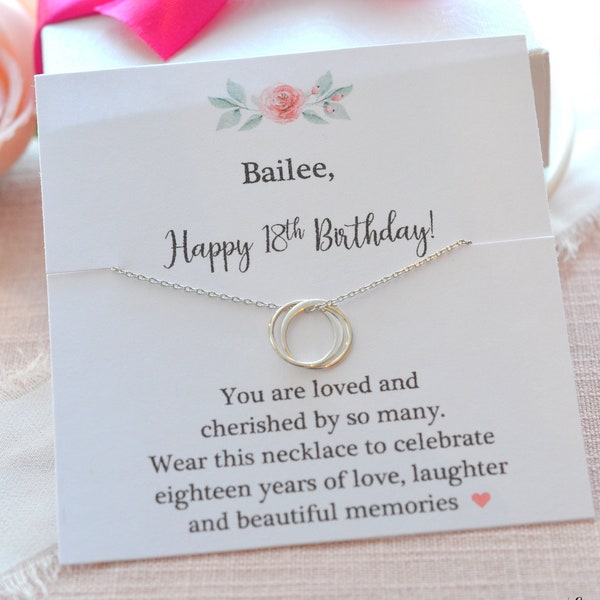
Where is `pink cloth`? pink cloth is located at coordinates (155, 17).